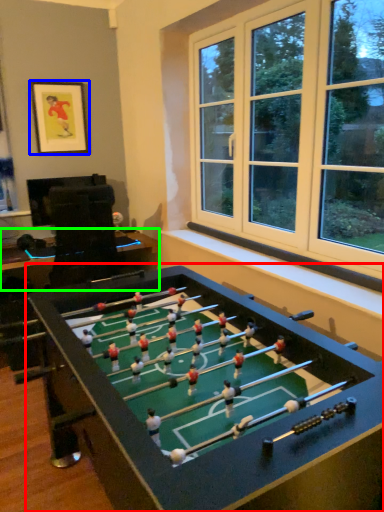
Question: Estimate the real-world distances between objects in this image. Which object is farther from table (highlighted by a red box), picture frame (highlighted by a blue box) or table (highlighted by a green box)?

Choices:
 (A) picture frame
 (B) table

Answer: (A)